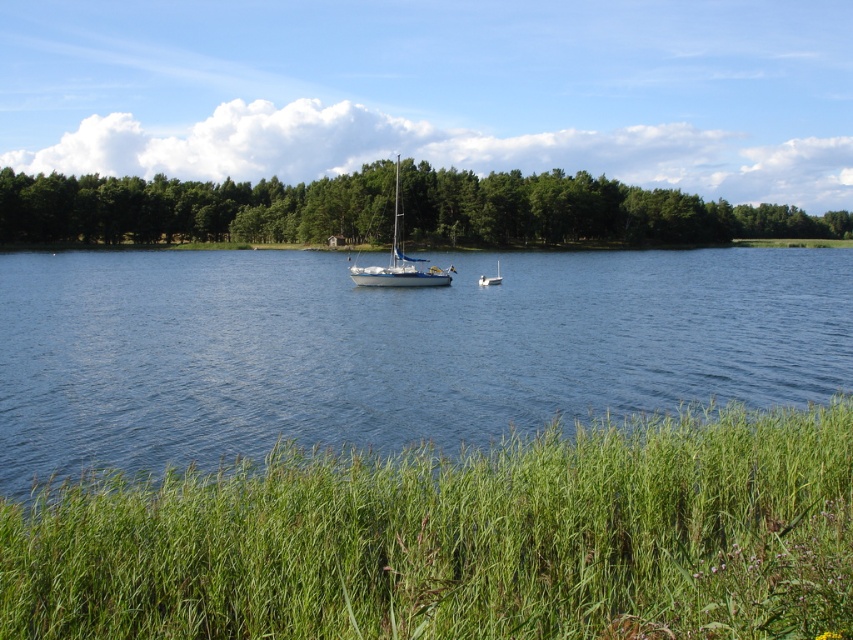
Consider the image. Who is lower down, green grass at lower center or blue water at center?

Positioned lower is green grass at lower center.

Is point (218, 538) in front of point (235, 422)?

That is True.

Between point (502, 552) and point (196, 364), which one is positioned in front?

Point (502, 552) is in front.

The image size is (853, 640). I want to click on green grass at lower center, so click(460, 540).

Based on the photo, between green leafy trees at upper center and white glossy boat at center, which one appears on the right side from the viewer's perspective?

green leafy trees at upper center is more to the right.

Can you confirm if green leafy trees at upper center is shorter than white glossy boat at center?

In fact, green leafy trees at upper center may be taller than white glossy boat at center.

Describe the element at coordinates (193, 209) in the screenshot. I see `green leafy trees at upper center` at that location.

Identify the location of green leafy trees at upper center. (193, 209).

Can you confirm if green grass at lower center is bigger than green leafy trees at upper center?

Actually, green grass at lower center might be smaller than green leafy trees at upper center.

Who is shorter, green grass at lower center or green leafy trees at upper center?

green grass at lower center is shorter.

Measure the distance between green grass at lower center and camera.

3.77 meters

Locate an element on the screen. Image resolution: width=853 pixels, height=640 pixels. green grass at lower center is located at coordinates (460, 540).